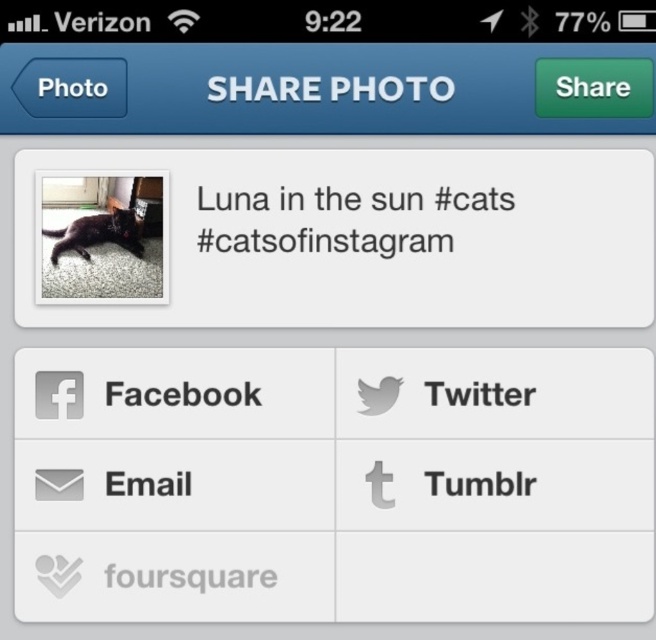
You are trying to share a photo of a cat via email using an Instagram app. You see the black fur cat at center and the gray matte email at center on your screen. Which object is positioned higher on the screen?

The black fur cat at center is located above the gray matte email at center, so it is positioned higher on the screen.

You are using Instagram to share a photo and notice a gray matte foursquare at the specified coordinate. What object is located at point (190, 577) on the Instagram interface?

The gray matte foursquare is located at point (190, 577) on the Instagram interface.

You are holding a phone with a 15 cm wide screen. You want to share a photo of the black fur cat at center but accidentally tap the gray matte email at center instead. What is the minimum distance in centimeters you need to move your finger to correct your tap?

The black fur cat at center and gray matte email at center are 30.68 centimeters apart. Since the screen is only 15 cm wide, the actual distance between them on the screen would be half of 30.68 cm, which is approximately 15.34 centimeters. Therefore, you need to move your finger at least 15.34 centimeters to correct your tap.